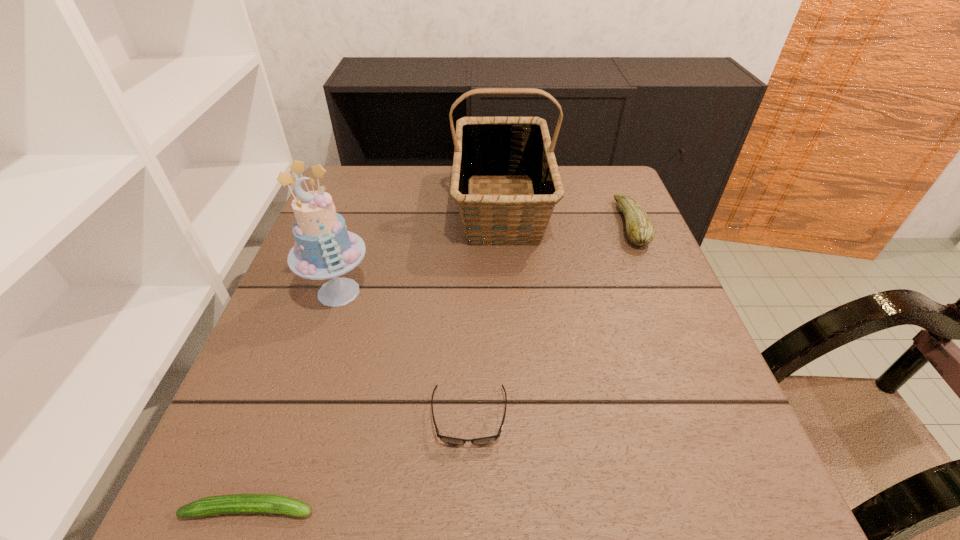
The width and height of the screenshot is (960, 540). What are the coordinates of `object that is at the right edge` in the screenshot? It's located at (640, 230).

You are a GUI agent. You are given a task and a screenshot of the screen. Output one action in this format:
    pyautogui.click(x=<x>, y=<y>)
    Task: Click on the object that is at the near left corner
    
    Given the screenshot: What is the action you would take?
    [x=236, y=503]

Identify the location of object located in the far right corner section of the desktop. (640, 230).

Identify the location of free space at the far edge of the desktop. (418, 197).

At what (x,y) coordinates should I click in order to perform the action: click on blank space at the near edge of the desktop. Please return your answer as a coordinate pair (x, y). Looking at the image, I should click on (466, 491).

Locate an element on the screen. The image size is (960, 540). vacant space at the left edge is located at coordinates (289, 331).

Image resolution: width=960 pixels, height=540 pixels. In order to click on vacant space at the right edge of the desktop in this screenshot , I will do `click(699, 410)`.

Where is `blank space at the far left corner of the desktop`? The height and width of the screenshot is (540, 960). blank space at the far left corner of the desktop is located at coordinates (374, 176).

Find the location of a particular element. vacant space at the far right corner of the desktop is located at coordinates (610, 210).

This screenshot has width=960, height=540. What are the coordinates of `empty space between the third farthest object and the second nearest object` in the screenshot? It's located at (404, 355).